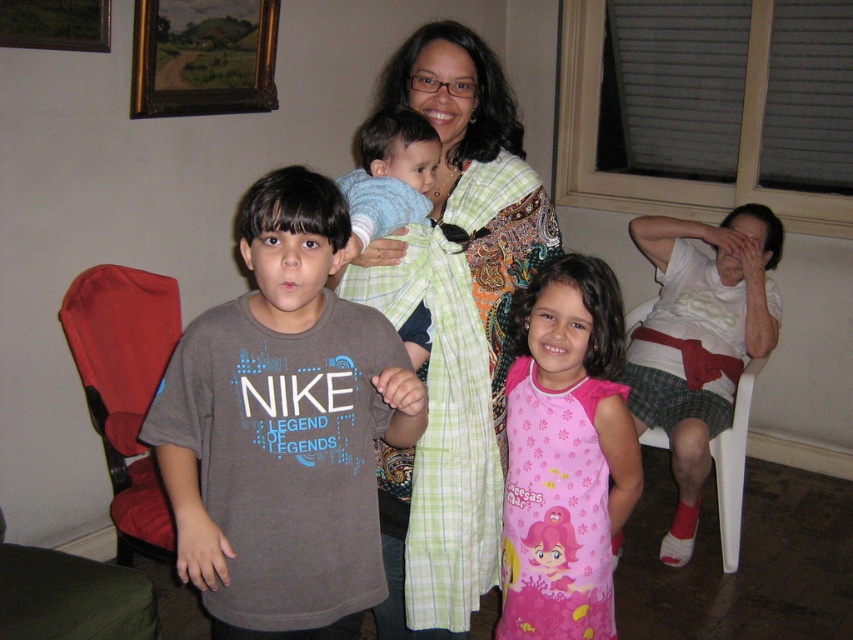
Does point (308, 420) come behind point (405, 195)?

No.

Does matte gray t-shirt at center have a smaller size compared to light blue plaid shirt at center?

No.

In order to click on matte gray t-shirt at center in this screenshot , I will do `click(283, 428)`.

Does pink fabric dress at center have a lesser width compared to red fabric highchair at left?

Yes, pink fabric dress at center is thinner than red fabric highchair at left.

Between pink fabric dress at center and red fabric highchair at left, which one is positioned lower?

pink fabric dress at center is lower down.

Describe the element at coordinates (566, 456) in the screenshot. I see `pink fabric dress at center` at that location.

Identify the location of pink fabric dress at center. The image size is (853, 640). (566, 456).

In the scene shown: Does multicolored patterned shawl at center have a smaller size compared to white plastic chair at right?

Actually, multicolored patterned shawl at center might be larger than white plastic chair at right.

Which is in front, point (451, 195) or point (627, 330)?

Point (451, 195)

Locate an element on the screen. This screenshot has height=640, width=853. multicolored patterned shawl at center is located at coordinates (456, 330).